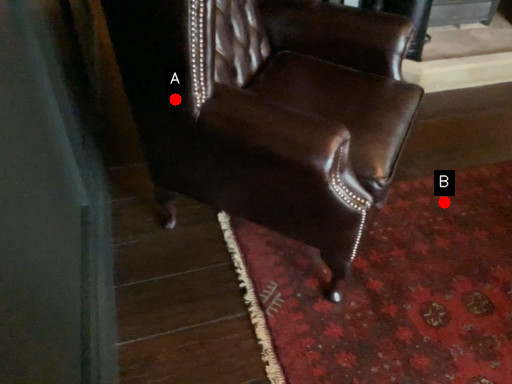
Question: Two points are circled on the image, labeled by A and B beside each circle. Among these points, which one is farthest from the camera?

Choices:
 (A) A is further
 (B) B is further

Answer: (B)